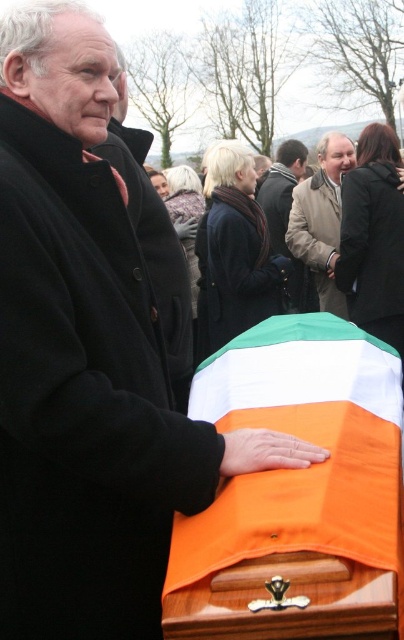
You are attending a funeral and need to determine the relative lengths of the orange fabric flag at lower center and the dark brown leather jacket at center. Which object is shorter?

The orange fabric flag at lower center is shorter than the dark brown leather jacket at center.

You are attending a memorial service and notice two people wearing coats. The beige wool coat at center is worn by a person standing next to the coffin, and the dark brown leather jacket at center is worn by another person nearby. Which person is shorter?

The beige wool coat at center is not as tall as dark brown leather jacket at center, so the person wearing the beige wool coat at center is shorter.

From the picture: You are attending a funeral and notice the orange fabric flag at lower center and the beige wool coat at center. Which object is shorter in height?

The orange fabric flag at lower center has a lesser height compared to the beige wool coat at center, so the orange fabric flag at lower center is shorter.